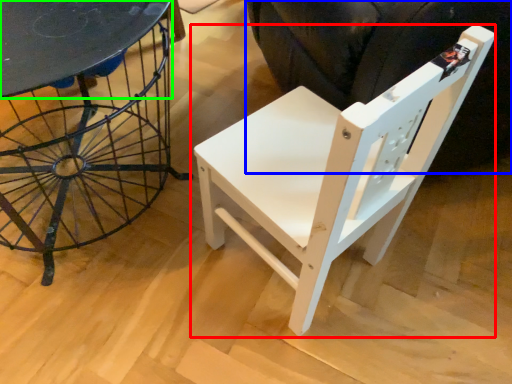
Question: Which object is the farthest from chair (highlighted by a red box)? Choose among these: swivel chair (highlighted by a blue box) or round table (highlighted by a green box).

Choices:
 (A) swivel chair
 (B) round table

Answer: (B)